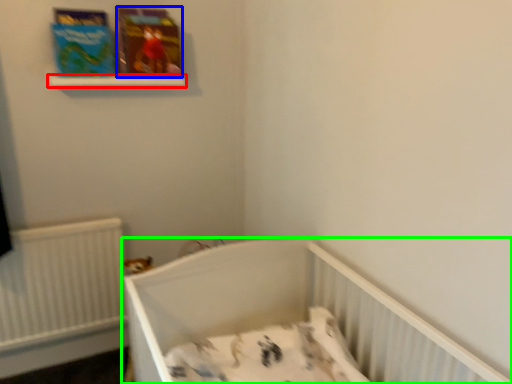
Question: Which object is the closest to the balustrade (highlighted by a red box)? Choose among these: paperback book (highlighted by a blue box) or infant bed (highlighted by a green box).

Choices:
 (A) paperback book
 (B) infant bed

Answer: (A)